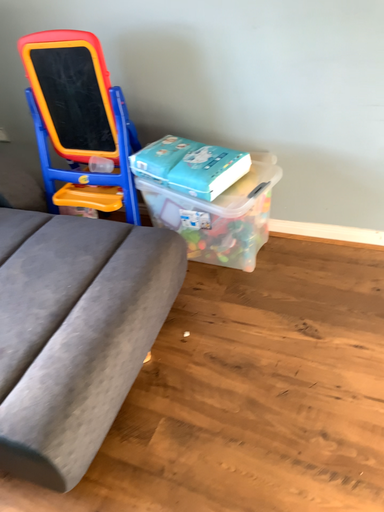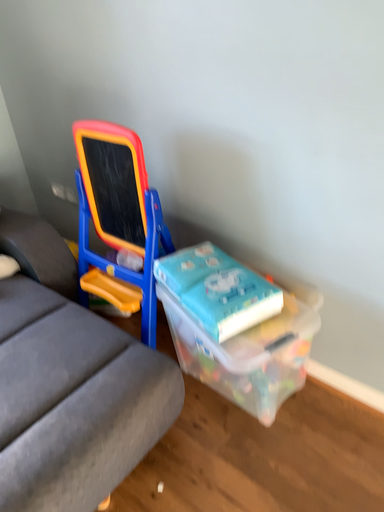
Question: How did the camera likely rotate when shooting the video?

Choices:
 (A) rotated upward
 (B) rotated downward

Answer: (A)